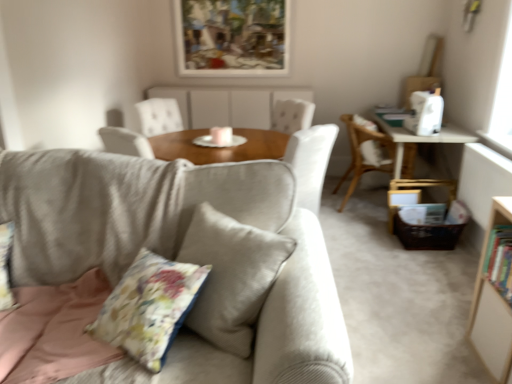
Question: Can you confirm if floral fabric pillow at center is wider than hardcover book at right?

Choices:
 (A) yes
 (B) no

Answer: (B)

Question: From the image's perspective, is floral fabric pillow at center located beneath hardcover book at right?

Choices:
 (A) no
 (B) yes

Answer: (B)

Question: Is floral fabric pillow at center behind hardcover book at right?

Choices:
 (A) yes
 (B) no

Answer: (B)

Question: Is floral fabric pillow at center thinner than hardcover book at right?

Choices:
 (A) no
 (B) yes

Answer: (B)

Question: Is hardcover book at right a part of floral fabric pillow at center?

Choices:
 (A) no
 (B) yes

Answer: (A)

Question: Considering the relative sizes of floral fabric pillow at center and hardcover book at right in the image provided, is floral fabric pillow at center bigger than hardcover book at right?

Choices:
 (A) no
 (B) yes

Answer: (B)

Question: Is floral fabric pillow at center at the left side of wooden chair at right?

Choices:
 (A) yes
 (B) no

Answer: (A)

Question: From a real-world perspective, does floral fabric pillow at center stand above wooden chair at right?

Choices:
 (A) yes
 (B) no

Answer: (A)

Question: Does floral fabric pillow at center have a smaller size compared to wooden chair at right?

Choices:
 (A) yes
 (B) no

Answer: (A)

Question: Is floral fabric pillow at center thinner than wooden chair at right?

Choices:
 (A) yes
 (B) no

Answer: (A)

Question: From a real-world perspective, is floral fabric pillow at center positioned under wooden chair at right based on gravity?

Choices:
 (A) yes
 (B) no

Answer: (B)

Question: Can you confirm if floral fabric pillow at center is positioned to the right of wooden chair at right?

Choices:
 (A) no
 (B) yes

Answer: (A)

Question: Considering the relative sizes of white wood bookcase at right and light gray fabric couch at center in the image provided, is white wood bookcase at right shorter than light gray fabric couch at center?

Choices:
 (A) no
 (B) yes

Answer: (B)